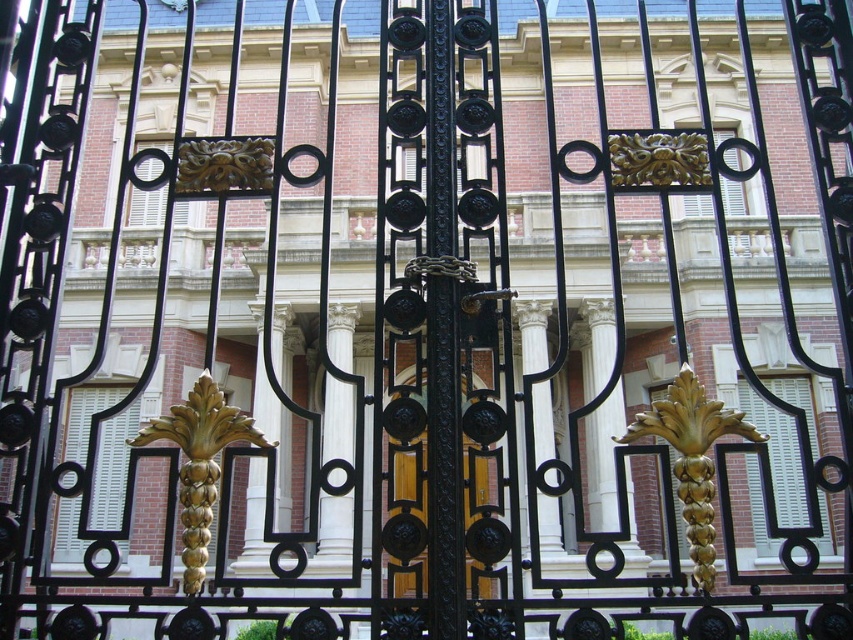
Question: Among these points, which one is farthest from the camera?

Choices:
 (A) (422, 516)
 (B) (705, 394)

Answer: (B)

Question: Which point appears closest to the camera in this image?

Choices:
 (A) (666, 416)
 (B) (469, 580)

Answer: (B)

Question: Is goldmetallicornament at center further to camera compared to wooden door at center?

Choices:
 (A) yes
 (B) no

Answer: (B)

Question: Where is goldmetallicornament at center located in relation to wooden door at center in the image?

Choices:
 (A) below
 (B) above

Answer: (A)

Question: Can you confirm if goldmetallicornament at center is bigger than wooden door at center?

Choices:
 (A) yes
 (B) no

Answer: (A)